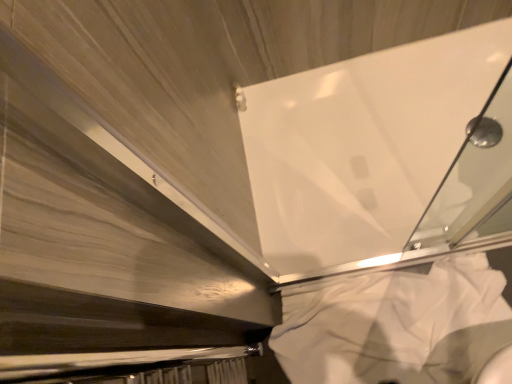
In order to click on white fabric at lower right in this screenshot , I will do `click(398, 326)`.

Describe the element at coordinates (398, 326) in the screenshot. This screenshot has height=384, width=512. I see `white fabric at lower right` at that location.

You are a GUI agent. You are given a task and a screenshot of the screen. Output one action in this format:
    pyautogui.click(x=<x>, y=<y>)
    Task: Click on the white fabric at lower right
    
    Given the screenshot: What is the action you would take?
    pyautogui.click(x=398, y=326)